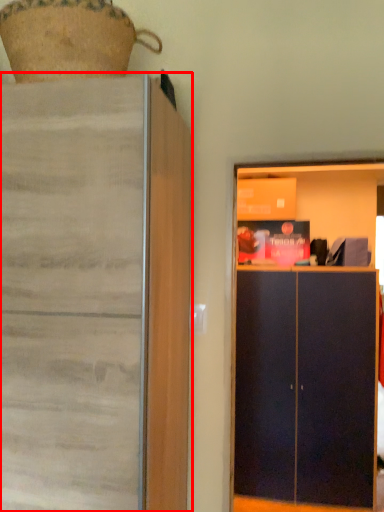
Question: Considering the relative positions of cupboard (annotated by the red box) and dresser in the image provided, where is cupboard (annotated by the red box) located with respect to the staircase?

Choices:
 (A) right
 (B) left

Answer: (B)